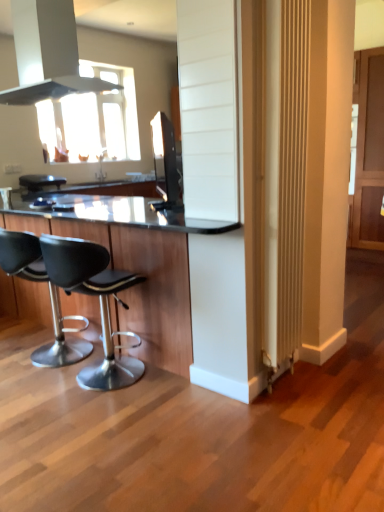
Question: Which is correct: black leather stool at lower left, the first chair positioned from the left, is inside black glass table at center, or outside of it?

Choices:
 (A) inside
 (B) outside

Answer: (A)

Question: Is point (49, 352) closer or farther from the camera than point (134, 326)?

Choices:
 (A) closer
 (B) farther

Answer: (B)

Question: Which object is the closest to the satin black tv at upper center?

Choices:
 (A) black glass table at center
 (B) black leather stool at lower left, the first chair positioned from the left
 (C) black leather stool at left, positioned as the 1th chair in right-to-left order
 (D) black matte exhaust hood at upper left
 (E) black leather bar stool at center

Answer: (E)

Question: Which object is the farthest from the black matte exhaust hood at upper left?

Choices:
 (A) black glass table at center
 (B) black leather bar stool at center
 (C) satin black tv at upper center
 (D) black leather stool at lower left, the 2th chair positioned from the right
 (E) black leather stool at left, the second chair in the left-to-right sequence

Answer: (C)